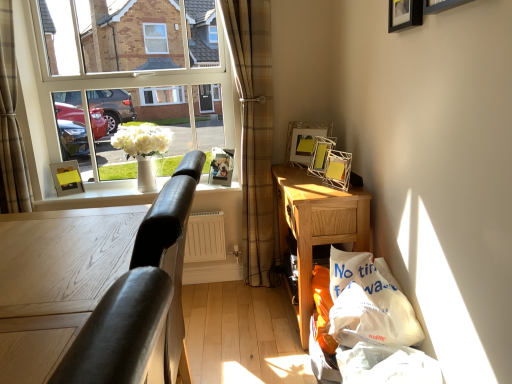
Find the location of a particular element. free space below brown plaid curtain at left, marked as the 2th curtain in a left-to-right arrangement (from a real-world perspective) is located at coordinates (253, 288).